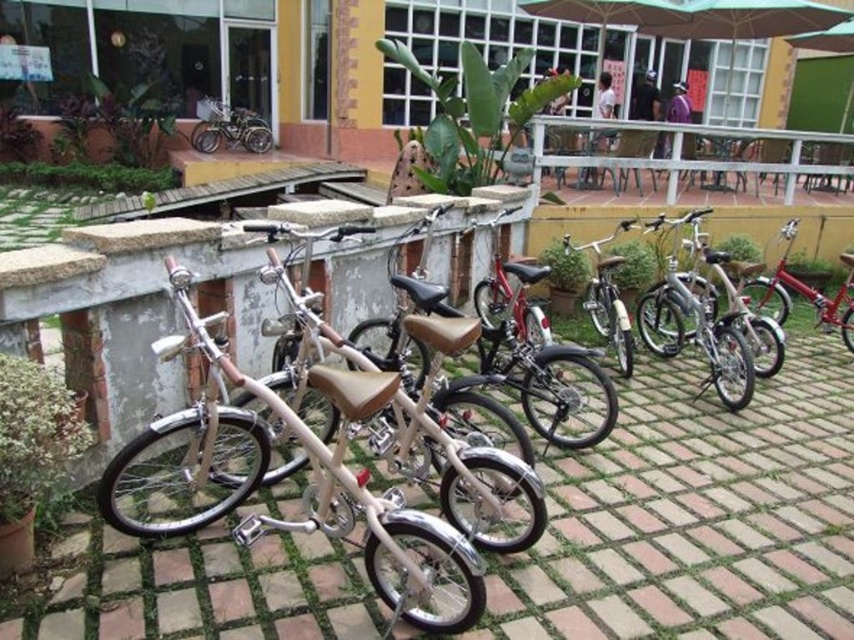
Question: Does matte beige bicycle at center come in front of shiny silver bicycle at center?

Choices:
 (A) no
 (B) yes

Answer: (B)

Question: Estimate the real-world distances between objects in this image. Which object is farther from the shiny silver bicycle at center?

Choices:
 (A) matte beige bicycle at center
 (B) silver metallic bicycle at upper left

Answer: (B)

Question: Is shiny silver bicycle at center further to camera compared to silver metallic bicycle at upper left?

Choices:
 (A) no
 (B) yes

Answer: (A)

Question: Which object is farther from the camera taking this photo?

Choices:
 (A) matte beige bicycle at center
 (B) shiny silver bicycle at center

Answer: (B)

Question: Which of the following is the closest to the observer?

Choices:
 (A) shiny silver bicycle at center
 (B) matte beige bicycle at center

Answer: (B)

Question: Is matte beige bicycle at center above shiny silver bicycle at center?

Choices:
 (A) yes
 (B) no

Answer: (B)